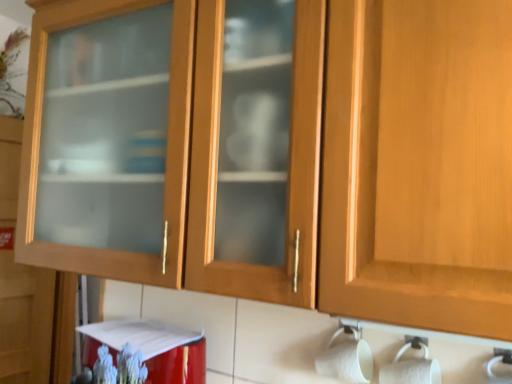
Question: Is red glossy appliance at lower left further to the viewer compared to matte glass cabinet at left?

Choices:
 (A) no
 (B) yes

Answer: (A)

Question: From a real-world perspective, is red glossy appliance at lower left on matte glass cabinet at left?

Choices:
 (A) no
 (B) yes

Answer: (A)

Question: Is red glossy appliance at lower left smaller than matte glass cabinet at left?

Choices:
 (A) no
 (B) yes

Answer: (B)

Question: Could matte glass cabinet at left be considered to be inside red glossy appliance at lower left?

Choices:
 (A) no
 (B) yes

Answer: (A)

Question: From a real-world perspective, is red glossy appliance at lower left beneath matte glass cabinet at left?

Choices:
 (A) yes
 (B) no

Answer: (A)

Question: From the image's perspective, is white matte toilet paper at lower right above or below matte glass cabinet at left?

Choices:
 (A) below
 (B) above

Answer: (A)

Question: Does point (x=318, y=360) appear closer or farther from the camera than point (x=5, y=160)?

Choices:
 (A) closer
 (B) farther

Answer: (A)

Question: Choose the correct answer: Is white matte toilet paper at lower right inside matte glass cabinet at left or outside it?

Choices:
 (A) outside
 (B) inside

Answer: (A)

Question: Is white matte toilet paper at lower right taller or shorter than matte glass cabinet at left?

Choices:
 (A) tall
 (B) short

Answer: (B)

Question: Considering the positions of red glossy appliance at lower left and matte glass cabinet at left in the image, is red glossy appliance at lower left taller or shorter than matte glass cabinet at left?

Choices:
 (A) tall
 (B) short

Answer: (B)

Question: Based on their sizes in the image, would you say red glossy appliance at lower left is bigger or smaller than matte glass cabinet at left?

Choices:
 (A) big
 (B) small

Answer: (B)

Question: Considering the positions of point (185, 357) and point (17, 306), is point (185, 357) closer or farther from the camera than point (17, 306)?

Choices:
 (A) farther
 (B) closer

Answer: (B)

Question: Based on their positions, is red glossy appliance at lower left located to the left or right of matte glass cabinet at left?

Choices:
 (A) left
 (B) right

Answer: (B)

Question: Is red glossy appliance at lower left bigger or smaller than white matte toilet paper at lower right?

Choices:
 (A) small
 (B) big

Answer: (B)

Question: Is red glossy appliance at lower left to the left or to the right of white matte toilet paper at lower right in the image?

Choices:
 (A) left
 (B) right

Answer: (A)